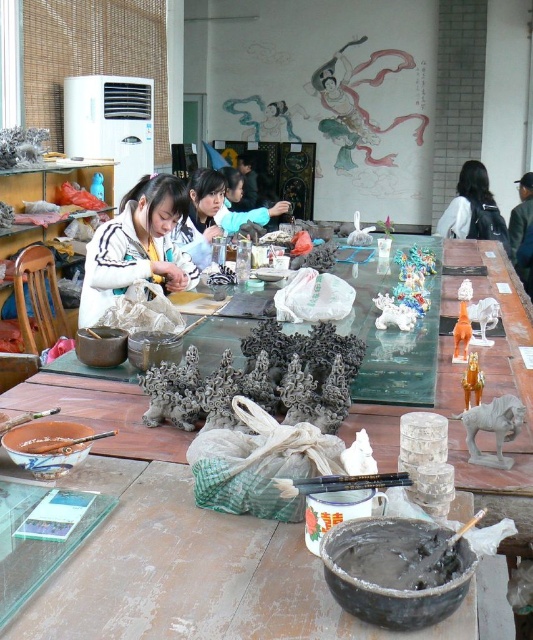
Is white matte jacket at center bigger than smooth gray paste at lower center?

Correct, white matte jacket at center is larger in size than smooth gray paste at lower center.

Between white matte jacket at center and smooth gray paste at lower center, which one has less height?

Standing shorter between the two is smooth gray paste at lower center.

At what (x,y) coordinates should I click in order to perform the action: click on white matte jacket at center. Please return your answer as a coordinate pair (x, y). The width and height of the screenshot is (533, 640). Looking at the image, I should click on point(136,246).

What do you see at coordinates (136, 246) in the screenshot?
I see `white matte jacket at center` at bounding box center [136, 246].

Can you confirm if white matte jacket at center is taller than black fabric bag at right?

No, white matte jacket at center is not taller than black fabric bag at right.

The image size is (533, 640). In order to click on white matte jacket at center in this screenshot , I will do `click(136, 246)`.

Between smooth gray paste at lower center and black fabric bag at right, which one appears on the right side from the viewer's perspective?

black fabric bag at right

Between point (387, 554) and point (506, 237), which one is positioned behind?

Positioned behind is point (506, 237).

This screenshot has height=640, width=533. I want to click on smooth gray paste at lower center, so click(399, 554).